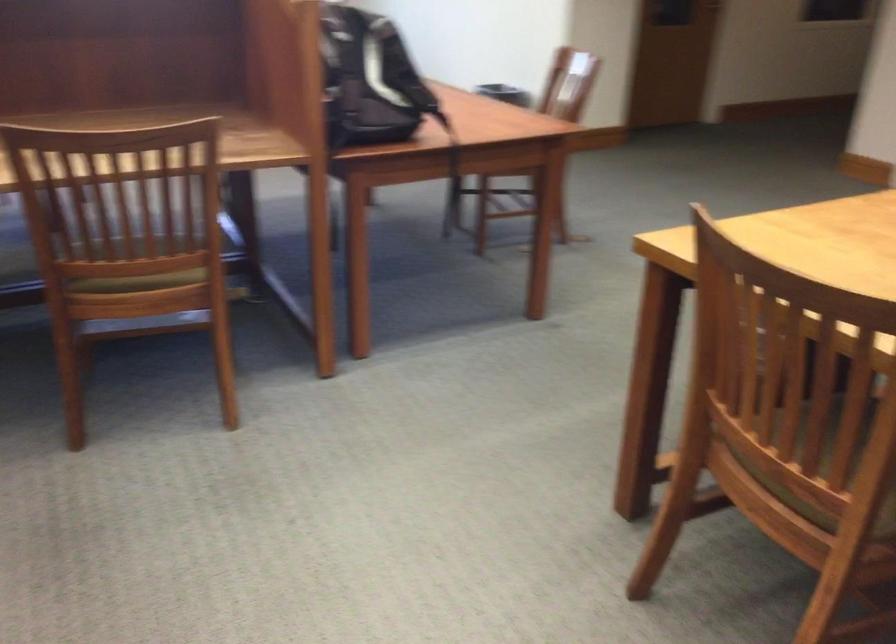
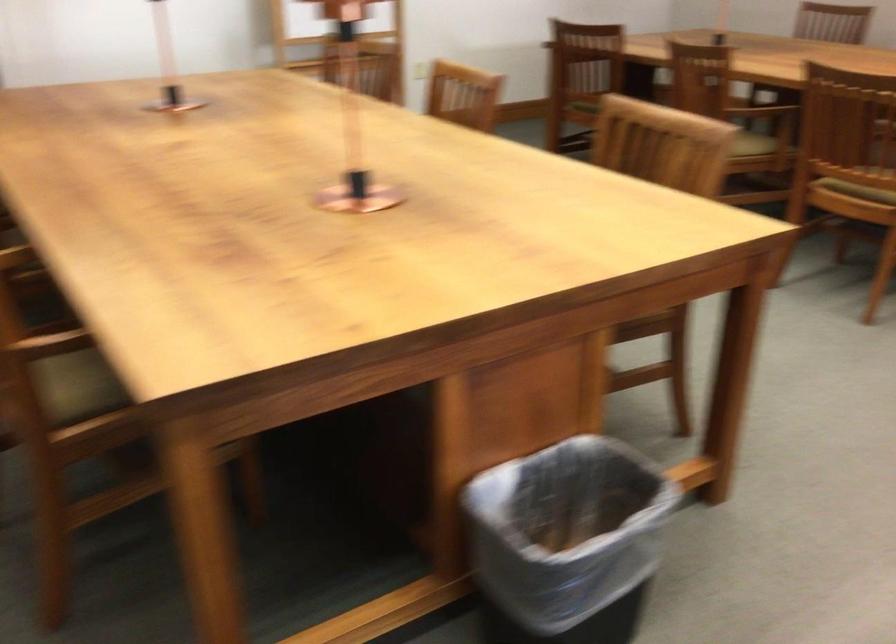
Question: I am providing you with two images of the same scene from different viewpoints. Which of the following objects are not visible in image2?

Choices:
 (A) green chair sitting surface
 (B) chair sitting surface
 (C) wooden chair sitting surface
 (D) beige cloth bag

Answer: (B)